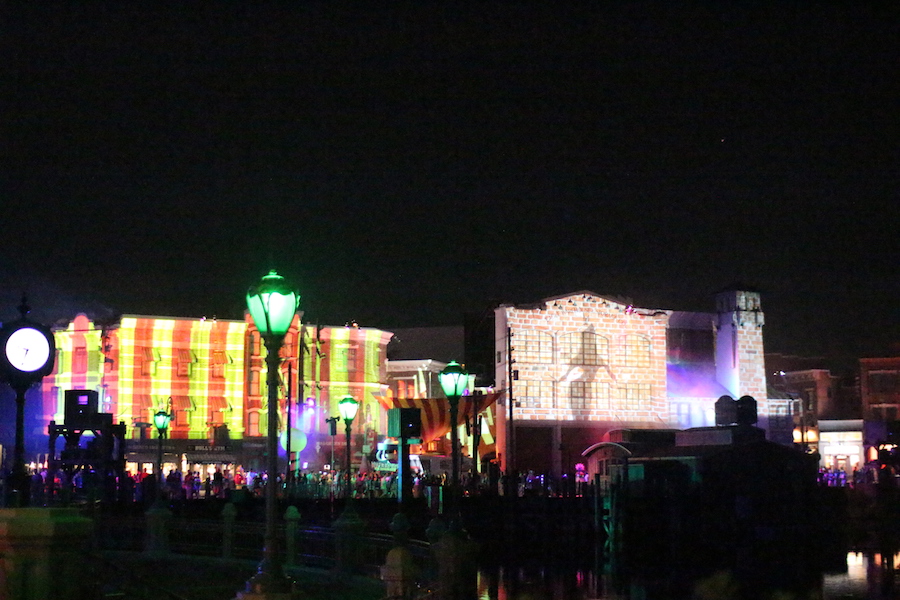
Where is `sky light`? The image size is (900, 600). sky light is located at coordinates (721, 139).